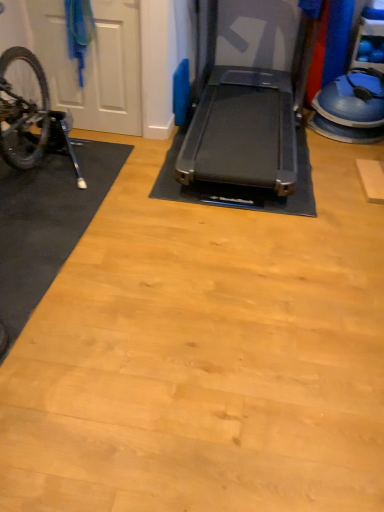
Question: Considering the relative sizes of shiny metallic bicycle at left and black rubber treadmill at center in the image provided, is shiny metallic bicycle at left shorter than black rubber treadmill at center?

Choices:
 (A) no
 (B) yes

Answer: (B)

Question: From the image's perspective, is shiny metallic bicycle at left beneath black rubber treadmill at center?

Choices:
 (A) yes
 (B) no

Answer: (A)

Question: Does shiny metallic bicycle at left turn towards black rubber treadmill at center?

Choices:
 (A) no
 (B) yes

Answer: (A)

Question: Does shiny metallic bicycle at left have a lesser width compared to black rubber treadmill at center?

Choices:
 (A) yes
 (B) no

Answer: (A)

Question: Does shiny metallic bicycle at left have a smaller size compared to black rubber treadmill at center?

Choices:
 (A) no
 (B) yes

Answer: (B)

Question: Considering the relative positions of shiny metallic bicycle at left and black rubber treadmill at center in the image provided, is shiny metallic bicycle at left behind black rubber treadmill at center?

Choices:
 (A) yes
 (B) no

Answer: (A)

Question: Is black rubber mat at left outside black rubber treadmill at center?

Choices:
 (A) no
 (B) yes

Answer: (B)

Question: Does black rubber mat at left have a lesser height compared to black rubber treadmill at center?

Choices:
 (A) yes
 (B) no

Answer: (A)

Question: Is black rubber mat at left further to the viewer compared to black rubber treadmill at center?

Choices:
 (A) yes
 (B) no

Answer: (B)

Question: Considering the relative sizes of black rubber mat at left and black rubber treadmill at center in the image provided, is black rubber mat at left taller than black rubber treadmill at center?

Choices:
 (A) no
 (B) yes

Answer: (A)

Question: From the image's perspective, is black rubber mat at left under black rubber treadmill at center?

Choices:
 (A) no
 (B) yes

Answer: (B)

Question: Can you confirm if black rubber mat at left is positioned to the left of black rubber treadmill at center?

Choices:
 (A) no
 (B) yes

Answer: (B)

Question: Considering the relative sizes of white matte door at left and shiny metallic bicycle at left in the image provided, is white matte door at left taller than shiny metallic bicycle at left?

Choices:
 (A) no
 (B) yes

Answer: (B)